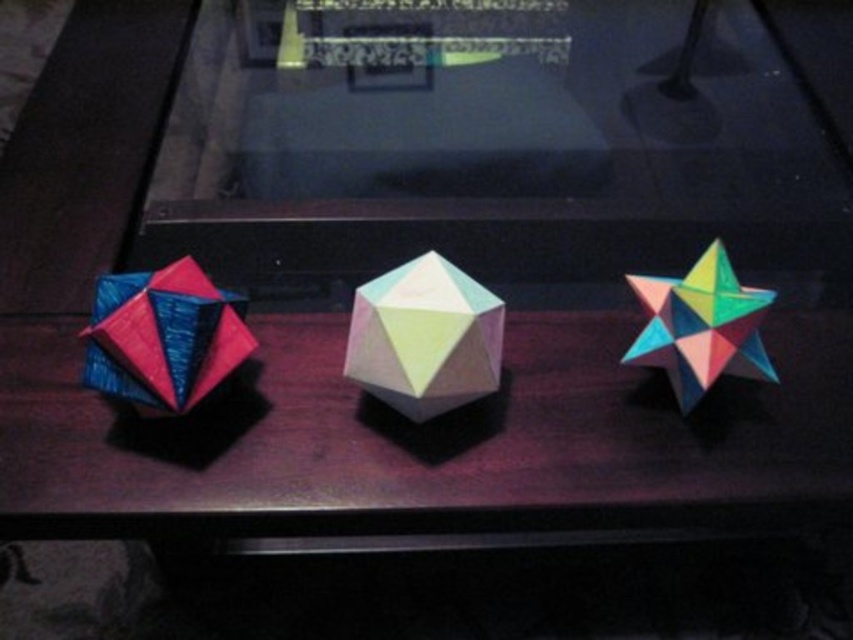
Between pastel paper polyhedron at center and multicolored paper star at right, which one has less height?

Standing shorter between the two is pastel paper polyhedron at center.

Which is above, pastel paper polyhedron at center or multicolored paper star at right?

multicolored paper star at right is higher up.

Does point (451, 348) lie behind point (683, 310)?

That is False.

Where is `pastel paper polyhedron at center`? Image resolution: width=853 pixels, height=640 pixels. pastel paper polyhedron at center is located at coordinates (424, 337).

Is pastel paper polyhedron at center above shiny blue and pink paper cube at left?

No.

Is point (498, 326) less distant than point (212, 291)?

Yes, point (498, 326) is in front of point (212, 291).

Image resolution: width=853 pixels, height=640 pixels. I want to click on pastel paper polyhedron at center, so click(x=424, y=337).

Is shiny blue and pink paper cube at left closer to the viewer compared to multicolored paper star at right?

Yes, shiny blue and pink paper cube at left is closer to the viewer.

Does shiny blue and pink paper cube at left have a lesser width compared to multicolored paper star at right?

No.

You are a GUI agent. You are given a task and a screenshot of the screen. Output one action in this format:
    pyautogui.click(x=<x>, y=<y>)
    Task: Click on the shiny blue and pink paper cube at left
    
    Given the screenshot: What is the action you would take?
    pyautogui.click(x=163, y=337)